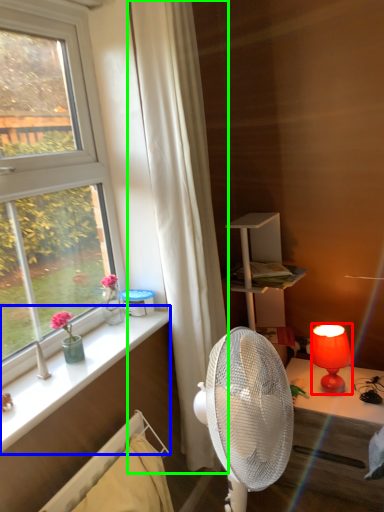
Question: Estimate the real-world distances between objects in this image. Which object is closer to lamp (highlighted by a red box), window sill (highlighted by a blue box) or curtain (highlighted by a green box)?

Choices:
 (A) window sill
 (B) curtain

Answer: (B)